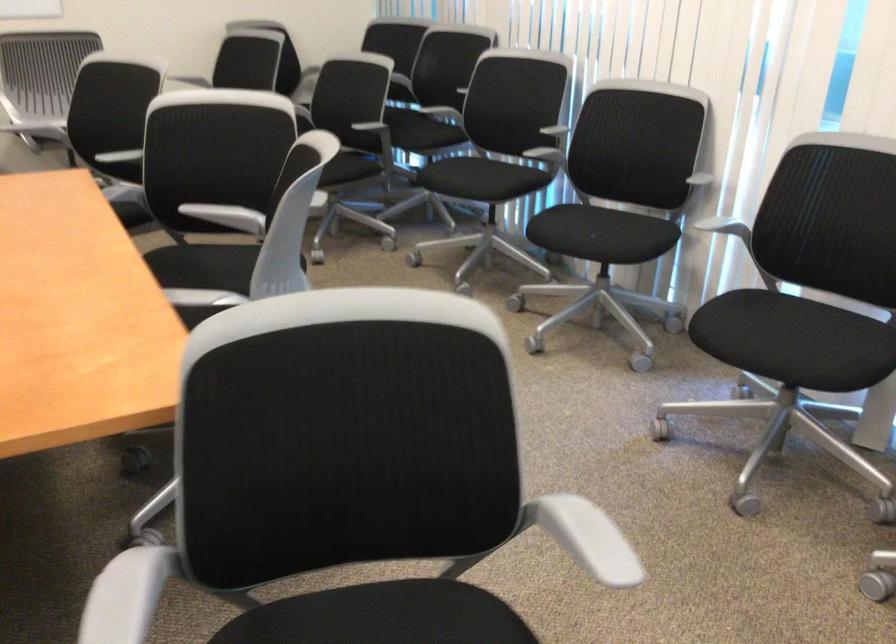
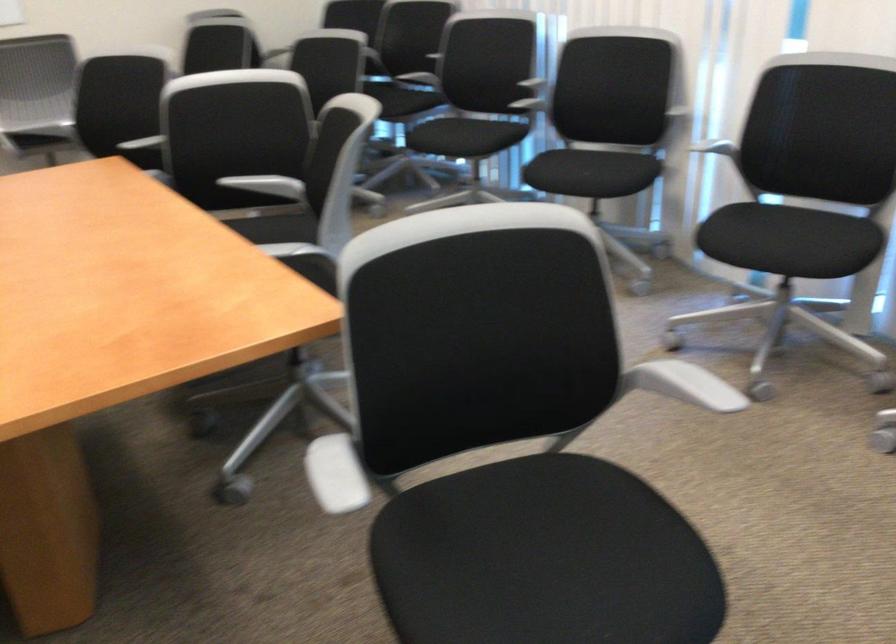
In the second image, find the point that corresponds to (791,346) in the first image.

(789, 240)